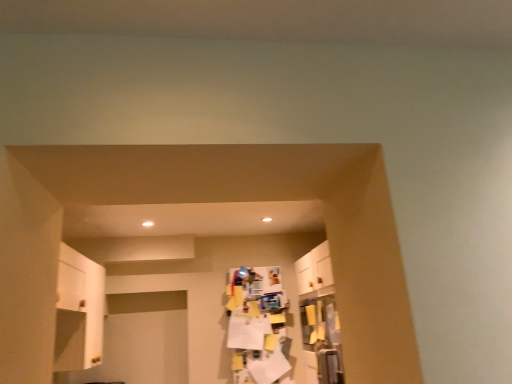
Where is `white paperboard at center`? The height and width of the screenshot is (384, 512). white paperboard at center is located at coordinates (257, 325).

The image size is (512, 384). What do you see at coordinates (257, 325) in the screenshot? I see `white paperboard at center` at bounding box center [257, 325].

Image resolution: width=512 pixels, height=384 pixels. What are the coordinates of `white paperboard at center` in the screenshot? It's located at (257, 325).